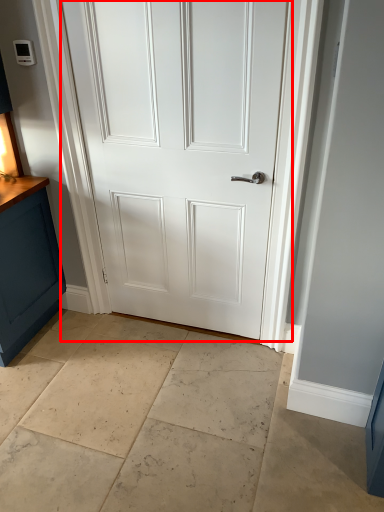
Question: From the image's perspective, what is the correct spatial relationship of door (annotated by the red box) in relation to concrete?

Choices:
 (A) above
 (B) below

Answer: (A)